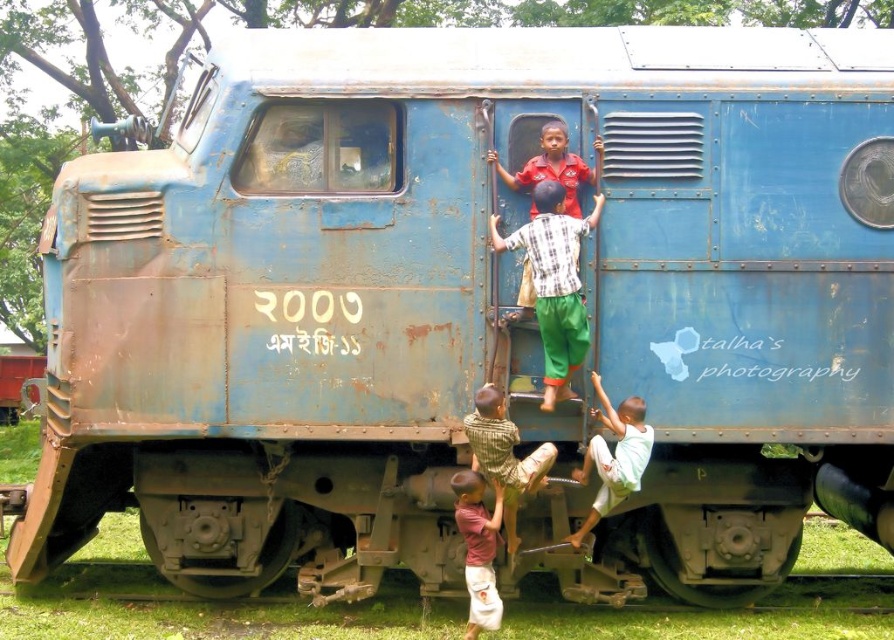
You are a photographer trying to capture the children near the train engine. You notice the striped cotton shirt at lower center and the white cotton pants at lower right. Which clothing item is positioned higher in the image?

The striped cotton shirt at lower center is above the white cotton pants at lower right, so the striped cotton shirt at lower center is positioned higher in the image.

From the picture: You are a photographer taking a picture of the matte pink shirt at lower center and the matte red shirt at center. Which shirt is closer to the camera?

The matte pink shirt at lower center is positioned under the matte red shirt at center, so it is closer to the camera.